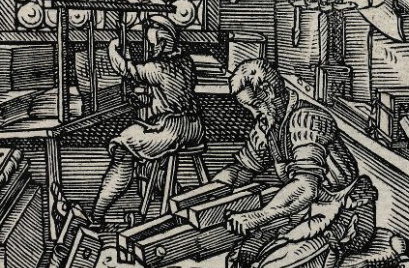
The height and width of the screenshot is (268, 409). I want to click on book, so click(x=74, y=103), click(x=212, y=68), click(x=214, y=76), click(x=7, y=162).